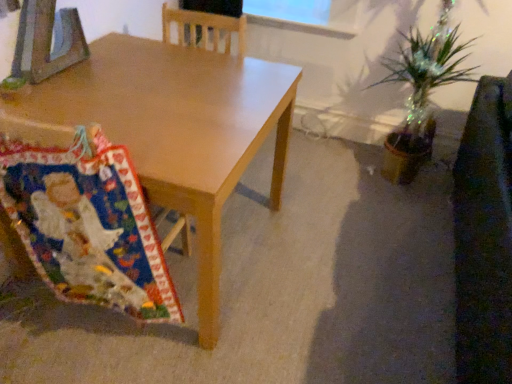
Question: Is dark brown leather swivel chair at right positioned with its back to matte wood desk at center?

Choices:
 (A) no
 (B) yes

Answer: (B)

Question: Considering the relative sizes of dark brown leather swivel chair at right and matte wood desk at center in the image provided, is dark brown leather swivel chair at right wider than matte wood desk at center?

Choices:
 (A) yes
 (B) no

Answer: (B)

Question: Is dark brown leather swivel chair at right positioned in front of matte wood desk at center?

Choices:
 (A) yes
 (B) no

Answer: (A)

Question: Considering the relative sizes of dark brown leather swivel chair at right and matte wood desk at center in the image provided, is dark brown leather swivel chair at right shorter than matte wood desk at center?

Choices:
 (A) no
 (B) yes

Answer: (A)

Question: Is the depth of dark brown leather swivel chair at right greater than that of matte wood desk at center?

Choices:
 (A) yes
 (B) no

Answer: (B)

Question: In the image, is dark brown leather swivel chair at right positioned in front of or behind multicolored fabric at lower left?

Choices:
 (A) behind
 (B) front

Answer: (B)

Question: Looking at the image, does dark brown leather swivel chair at right seem bigger or smaller compared to multicolored fabric at lower left?

Choices:
 (A) small
 (B) big

Answer: (B)

Question: Is dark brown leather swivel chair at right inside or outside of multicolored fabric at lower left?

Choices:
 (A) inside
 (B) outside

Answer: (B)

Question: In terms of height, does dark brown leather swivel chair at right look taller or shorter compared to multicolored fabric at lower left?

Choices:
 (A) short
 (B) tall

Answer: (B)

Question: Is point (41, 276) closer or farther from the camera than point (493, 137)?

Choices:
 (A) closer
 (B) farther

Answer: (A)

Question: Is multicolored fabric at lower left bigger or smaller than dark brown leather swivel chair at right?

Choices:
 (A) small
 (B) big

Answer: (A)

Question: From a real-world perspective, is multicolored fabric at lower left physically located above or below dark brown leather swivel chair at right?

Choices:
 (A) below
 (B) above

Answer: (B)

Question: Is multicolored fabric at lower left inside or outside of dark brown leather swivel chair at right?

Choices:
 (A) outside
 (B) inside

Answer: (A)

Question: Considering the positions of dark brown leather swivel chair at right and matte wood desk at center in the image, is dark brown leather swivel chair at right taller or shorter than matte wood desk at center?

Choices:
 (A) short
 (B) tall

Answer: (B)

Question: Is point (505, 331) closer or farther from the camera than point (138, 99)?

Choices:
 (A) farther
 (B) closer

Answer: (B)